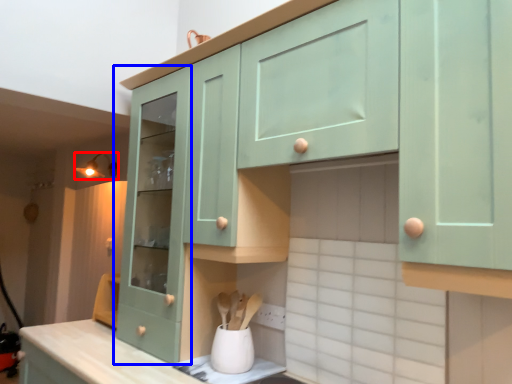
Question: Which object appears closest to the camera in this image, light fixture (highlighted by a red box) or cabinetry (highlighted by a blue box)?

Choices:
 (A) light fixture
 (B) cabinetry

Answer: (B)